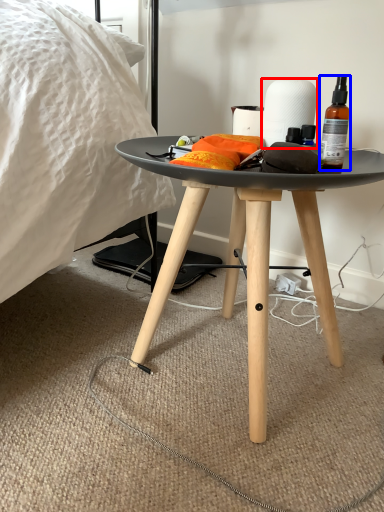
Question: Which object is further to the camera taking this photo, paper towel (highlighted by a red box) or bottle (highlighted by a blue box)?

Choices:
 (A) paper towel
 (B) bottle

Answer: (A)